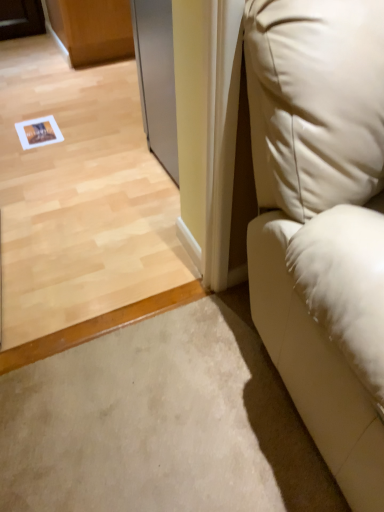
Locate an element on the screen. The height and width of the screenshot is (512, 384). free space in front of silver metallic screen door at upper center is located at coordinates (144, 193).